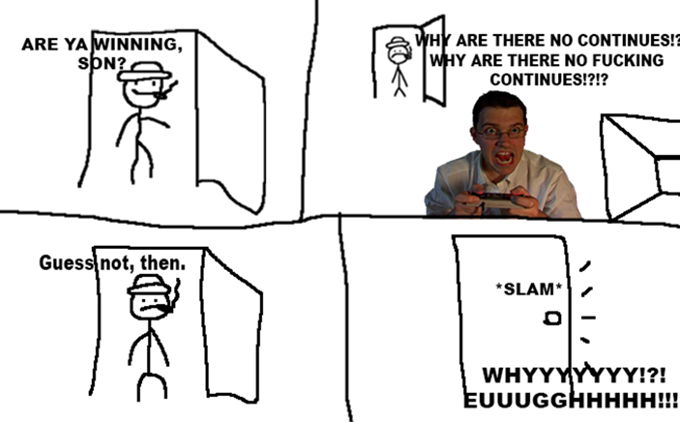
Locate an element on the screen. The height and width of the screenshot is (422, 680). tv is located at coordinates (653, 181).